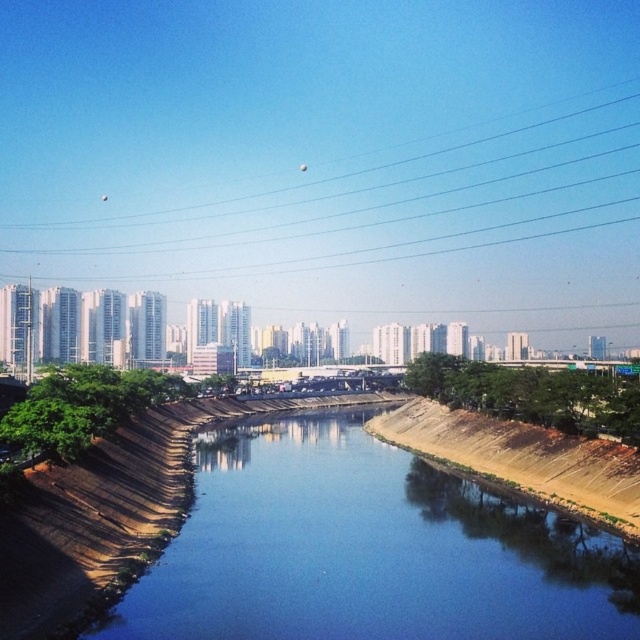
Question: Does blue smooth water at center appear on the left side of transparent glass power lines at upper center?

Choices:
 (A) yes
 (B) no

Answer: (B)

Question: Does blue smooth water at center have a lesser width compared to transparent glass power lines at upper center?

Choices:
 (A) yes
 (B) no

Answer: (A)

Question: Which point is farther from the camera taking this photo?

Choices:
 (A) (198, 480)
 (B) (451, 145)

Answer: (B)

Question: Which of the following is the closest to the observer?

Choices:
 (A) click(x=163, y=211)
 (B) click(x=148, y=634)

Answer: (B)

Question: Is blue smooth water at center wider than transparent glass power lines at upper center?

Choices:
 (A) no
 (B) yes

Answer: (A)